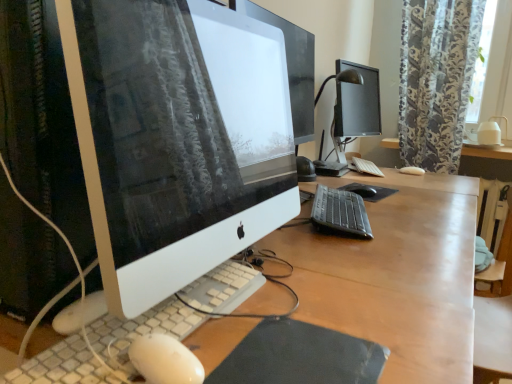
This screenshot has width=512, height=384. I want to click on free space above black plastic keyboard at center, acting as the second computer keyboard starting from the left (from a real-world perspective), so click(334, 197).